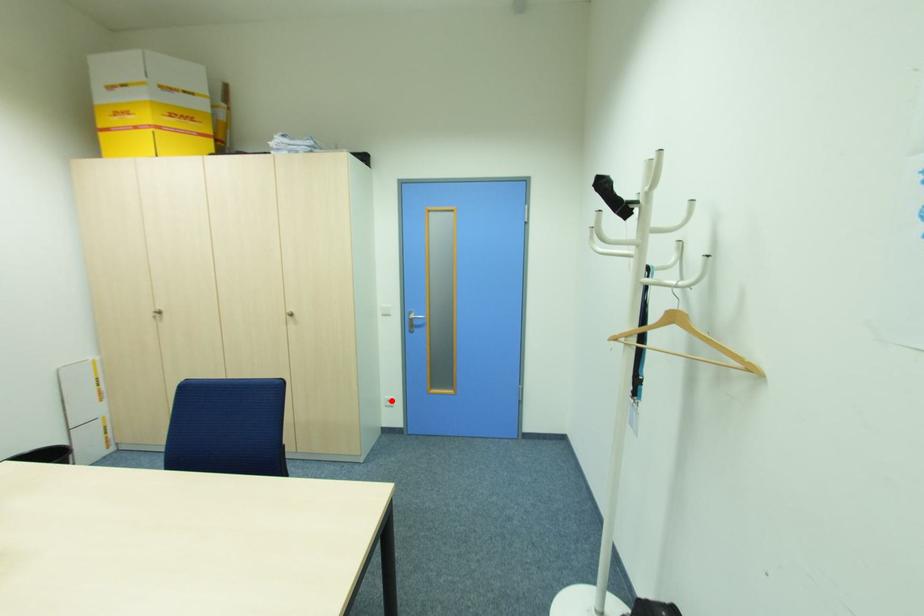
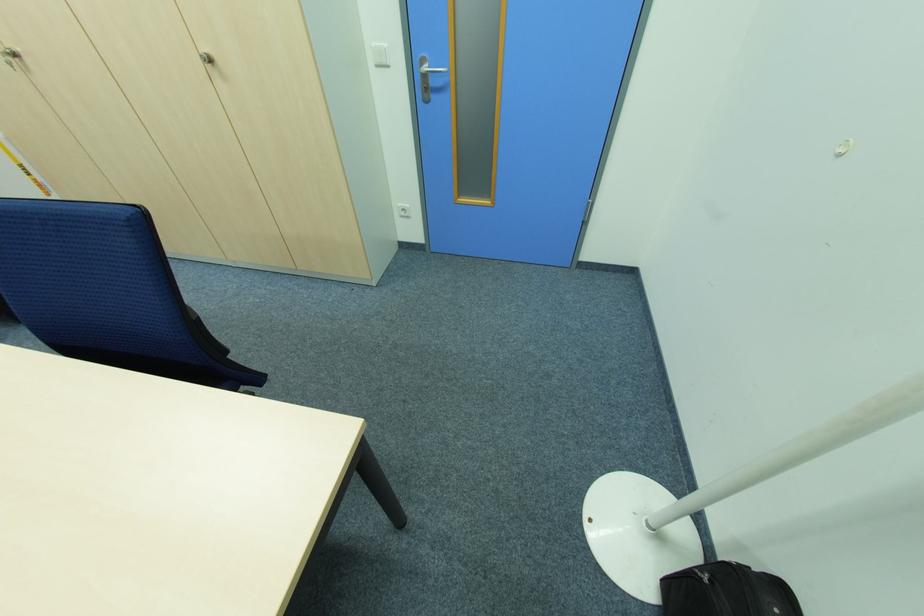
The point at the highlighted location is marked in the first image. Where is the corresponding point in the second image?

(407, 209)